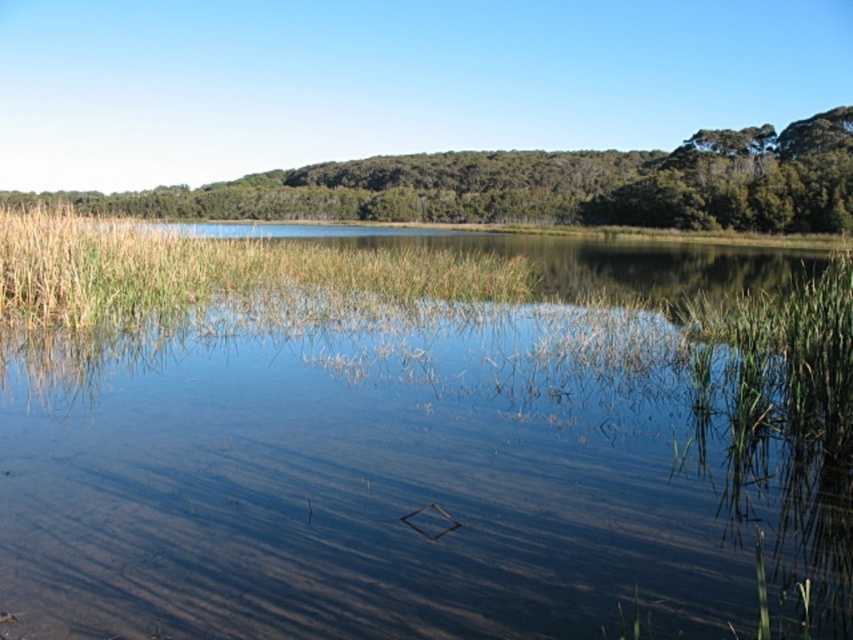
Question: Can you confirm if clear water at center is bigger than green grass at center?

Choices:
 (A) yes
 (B) no

Answer: (A)

Question: Which object is the farthest from the green leafy tree at upper center?

Choices:
 (A) clear water at center
 (B) green grass at center

Answer: (A)

Question: Among these objects, which one is farthest from the camera?

Choices:
 (A) green leafy tree at upper center
 (B) clear water at center

Answer: (A)

Question: Does green leafy tree at upper center appear under green grass at center?

Choices:
 (A) yes
 (B) no

Answer: (B)

Question: Which of the following is the closest to the observer?

Choices:
 (A) (102, 212)
 (B) (213, 417)

Answer: (B)

Question: Can you confirm if clear water at center is bigger than green grass at center?

Choices:
 (A) no
 (B) yes

Answer: (B)